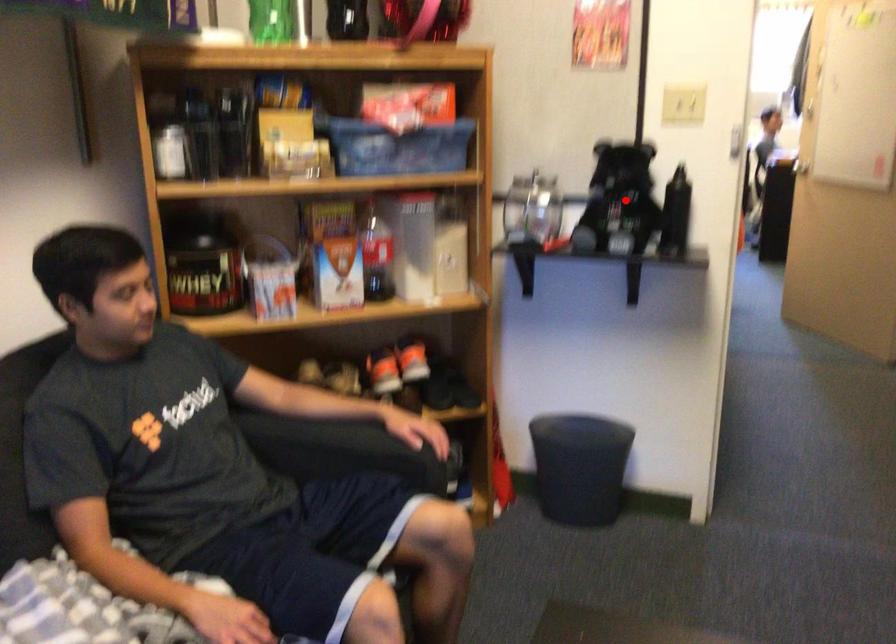
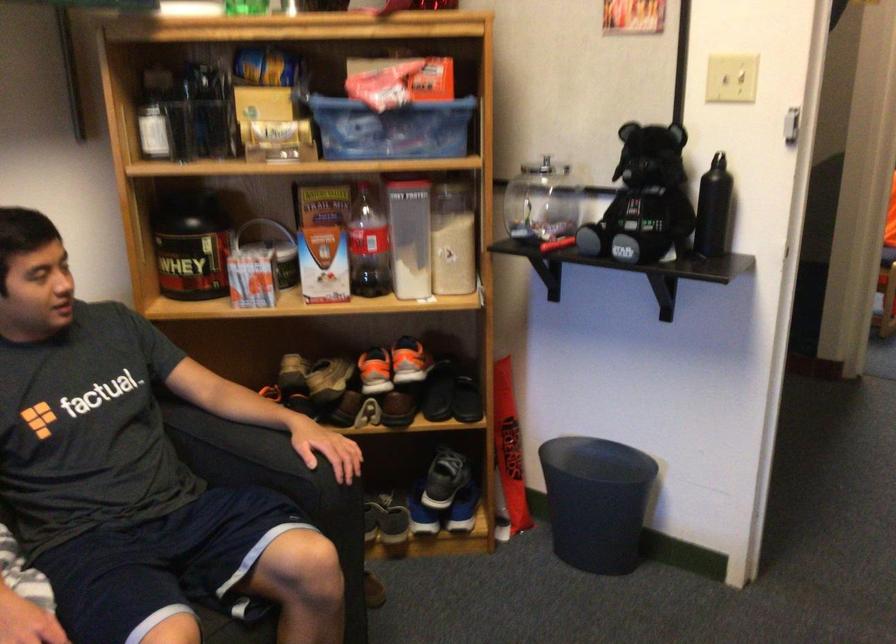
Find the pixel in the second image that matches the highlighted location in the first image.

(643, 200)